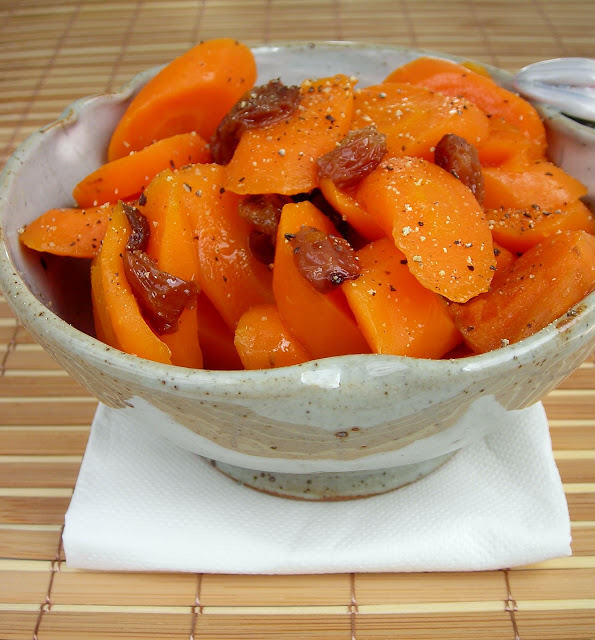
In order to click on bowl in this screenshot , I will do `click(320, 436)`.